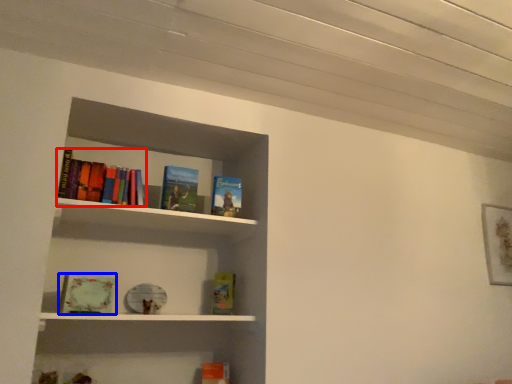
Question: Which object appears farthest to the camera in this image, book (highlighted by a red box) or book (highlighted by a blue box)?

Choices:
 (A) book
 (B) book

Answer: (A)